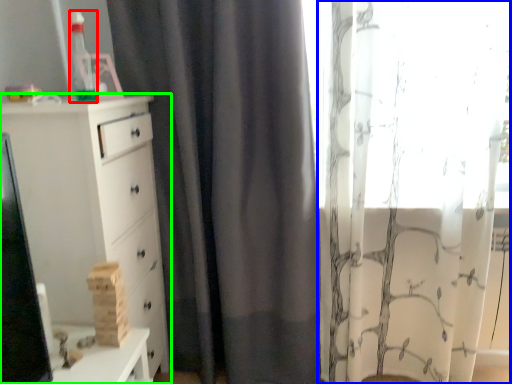
Question: Based on their relative distances, which object is farther from toy (highlighted by a red box)? Choose from curtain (highlighted by a blue box) and chest of drawers (highlighted by a green box).

Choices:
 (A) curtain
 (B) chest of drawers

Answer: (A)